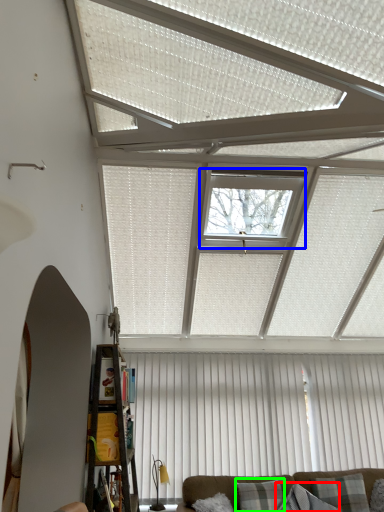
Question: Which object is positioned farthest from pillow (highlighted by a red box)? Select from window (highlighted by a blue box) and pillow (highlighted by a green box).

Choices:
 (A) window
 (B) pillow

Answer: (A)